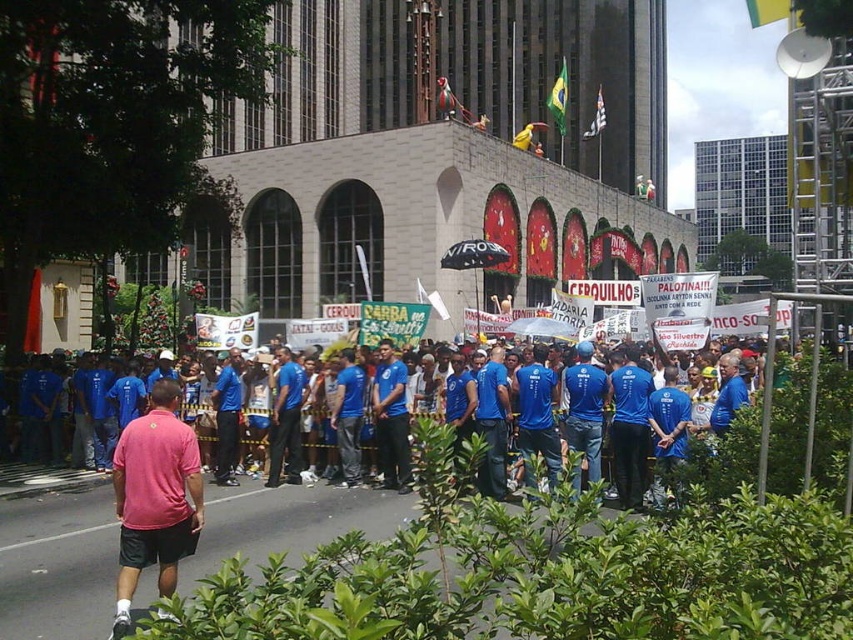
Question: Can you confirm if pink cotton polo shirt at center is positioned above blue fabric shirt at center?

Choices:
 (A) no
 (B) yes

Answer: (B)

Question: Can you confirm if pink cotton polo shirt at center is smaller than blue fabric shirt at center?

Choices:
 (A) yes
 (B) no

Answer: (B)

Question: Which of the following is the closest to the observer?

Choices:
 (A) pink cotton polo shirt at center
 (B) blue fabric shirt at center

Answer: (A)

Question: Where is pink cotton polo shirt at center located in relation to blue fabric shirt at center in the image?

Choices:
 (A) right
 (B) left

Answer: (B)